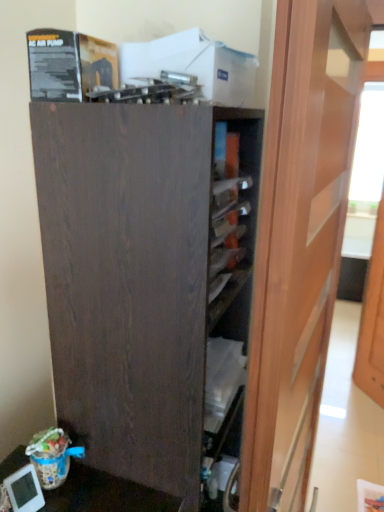
This screenshot has width=384, height=512. Describe the element at coordinates (372, 320) in the screenshot. I see `wooden door at right, which is counted as the 1th door, starting from the right` at that location.

Measure the distance between wooden door at right, marked as the 1th door in a back-to-front arrangement, and camera.

wooden door at right, marked as the 1th door in a back-to-front arrangement, is 5.20 feet away from camera.

Identify the location of dark wood cupboard at center. This screenshot has width=384, height=512. (149, 282).

In order to face dark wood cupboard at center, should I rotate leftwards or rightwards?

You should look left and rotate roughly 1.440 degrees.

In order to click on matte wood door at center, the first door viewed from the front in this screenshot , I will do [x=299, y=240].

This screenshot has height=512, width=384. What are the coordinates of `wooden door at right, marked as the second door in a front-to-back arrangement` in the screenshot? It's located at (372, 320).

From the image's perspective, which object appears higher, wooden door at right, arranged as the 2th door when viewed from the left, or dark wood cupboard at center?

From the image's view, wooden door at right, arranged as the 2th door when viewed from the left, is above.

Find the location of a particular element. cupboard in front of the wooden door at right, marked as the 1th door in a back-to-front arrangement is located at coordinates (149, 282).

Is wooden door at right, arranged as the 2th door when viewed from the left, bigger than dark wood cupboard at center?

Incorrect, wooden door at right, arranged as the 2th door when viewed from the left, is not larger than dark wood cupboard at center.

Is wooden door at right, marked as the second door in a front-to-back arrangement, beside dark wood cupboard at center?

No, wooden door at right, marked as the second door in a front-to-back arrangement, is not next to dark wood cupboard at center.

Does point (370, 340) come closer to viewer compared to point (323, 193)?

That is False.

What's the angular difference between wooden door at right, marked as the 1th door in a back-to-front arrangement, and matte wood door at center, the 2th door positioned from the right,'s facing directions?

The facing directions of wooden door at right, marked as the 1th door in a back-to-front arrangement, and matte wood door at center, the 2th door positioned from the right, are 138 degrees apart.

How far apart are wooden door at right, marked as the 1th door in a back-to-front arrangement, and matte wood door at center, the 2th door positioned from the right?

A distance of 1.04 meters exists between wooden door at right, marked as the 1th door in a back-to-front arrangement, and matte wood door at center, the 2th door positioned from the right.

From their relative heights in the image, would you say wooden door at right, arranged as the 2th door when viewed from the left, is taller or shorter than matte wood door at center, the first door viewed from the front?

wooden door at right, arranged as the 2th door when viewed from the left, is shorter than matte wood door at center, the first door viewed from the front.

Does dark wood cupboard at center turn towards wooden door at right, arranged as the 2th door when viewed from the left?

No, dark wood cupboard at center does not turn towards wooden door at right, arranged as the 2th door when viewed from the left.

What's the angular difference between dark wood cupboard at center and wooden door at right, arranged as the 2th door when viewed from the left,'s facing directions?

There is a 141-degree angle between the facing directions of dark wood cupboard at center and wooden door at right, arranged as the 2th door when viewed from the left.

This screenshot has height=512, width=384. I want to click on door beneath the dark wood cupboard at center (from a real-world perspective), so (x=372, y=320).

Which of these two, dark wood cupboard at center or wooden door at right, arranged as the 2th door when viewed from the left, is wider?

dark wood cupboard at center is wider.

Based on the photo, how much distance is there between matte wood door at center, the 2th door positioned from the right, and dark wood cupboard at center?

matte wood door at center, the 2th door positioned from the right, is 9.08 inches from dark wood cupboard at center.

Is the depth of matte wood door at center, the first door viewed from the front, less than that of dark wood cupboard at center?

Yes, matte wood door at center, the first door viewed from the front, is closer to the viewer.

From a real-world perspective, between matte wood door at center, the 2th door positioned from the right, and dark wood cupboard at center, who is vertically higher?

matte wood door at center, the 2th door positioned from the right, is physically above.

Who is smaller, matte wood door at center, the 2th door positioned from the right, or dark wood cupboard at center?

Smaller between the two is matte wood door at center, the 2th door positioned from the right.

Is dark wood cupboard at center shorter than matte wood door at center, the first door viewed from the front?

Yes.

Does dark wood cupboard at center have a greater width compared to matte wood door at center, the 2th door positioned from the right?

Correct, the width of dark wood cupboard at center exceeds that of matte wood door at center, the 2th door positioned from the right.

Which is more to the left, dark wood cupboard at center or matte wood door at center, the 2th door positioned from the right?

dark wood cupboard at center is more to the left.

From the image's perspective, is dark wood cupboard at center positioned above or below matte wood door at center, the 1th door viewed from the left?

From the image's perspective, dark wood cupboard at center appears below matte wood door at center, the 1th door viewed from the left.

Does matte wood door at center, the first door viewed from the front, have a lesser width compared to wooden door at right, marked as the second door in a front-to-back arrangement?

No, matte wood door at center, the first door viewed from the front, is not thinner than wooden door at right, marked as the second door in a front-to-back arrangement.

Can wooden door at right, marked as the 1th door in a back-to-front arrangement, be found inside matte wood door at center, the 1th door viewed from the left?

No, wooden door at right, marked as the 1th door in a back-to-front arrangement, is not inside matte wood door at center, the 1th door viewed from the left.

Are matte wood door at center, arranged as the second door when viewed from the back, and wooden door at right, which is counted as the 1th door, starting from the right, located far from each other?

Yes, matte wood door at center, arranged as the second door when viewed from the back, and wooden door at right, which is counted as the 1th door, starting from the right, are quite far apart.

From a real-world perspective, between matte wood door at center, arranged as the second door when viewed from the back, and wooden door at right, which is counted as the 1th door, starting from the right, who is vertically higher?

In real-world perspective, matte wood door at center, arranged as the second door when viewed from the back, is above.

The height and width of the screenshot is (512, 384). Identify the location of cupboard below the wooden door at right, arranged as the 2th door when viewed from the left (from the image's perspective). (149, 282).

Where is `door on the right of matte wood door at center, arranged as the second door when viewed from the back`? This screenshot has width=384, height=512. door on the right of matte wood door at center, arranged as the second door when viewed from the back is located at coordinates (372, 320).

From the image, which object appears to be farther from wooden door at right, which is counted as the 1th door, starting from the right, matte wood door at center, the 2th door positioned from the right, or dark wood cupboard at center?

Among the two, dark wood cupboard at center is located further to wooden door at right, which is counted as the 1th door, starting from the right.

Considering their positions, is dark wood cupboard at center positioned closer to wooden door at right, arranged as the 2th door when viewed from the left, than matte wood door at center, arranged as the second door when viewed from the back?

matte wood door at center, arranged as the second door when viewed from the back.

Based on their spatial positions, is dark wood cupboard at center or wooden door at right, marked as the 1th door in a back-to-front arrangement, closer to matte wood door at center, the 2th door positioned from the right?

The object closer to matte wood door at center, the 2th door positioned from the right, is dark wood cupboard at center.

From the image, which object appears to be nearer to dark wood cupboard at center, matte wood door at center, the 2th door positioned from the right, or wooden door at right, which is counted as the 1th door, starting from the right?

Based on the image, matte wood door at center, the 2th door positioned from the right, appears to be nearer to dark wood cupboard at center.

Estimate the real-world distances between objects in this image. Which object is closer to dark wood cupboard at center, wooden door at right, which is counted as the 1th door, starting from the right, or matte wood door at center, the 2th door positioned from the right?

The object closer to dark wood cupboard at center is matte wood door at center, the 2th door positioned from the right.

Based on their spatial positions, is wooden door at right, arranged as the 2th door when viewed from the left, or dark wood cupboard at center closer to matte wood door at center, arranged as the second door when viewed from the back?

dark wood cupboard at center is closer to matte wood door at center, arranged as the second door when viewed from the back.

Identify the location of cupboard between matte wood door at center, the first door viewed from the front, and wooden door at right, marked as the second door in a front-to-back arrangement, along the z-axis. (149, 282).